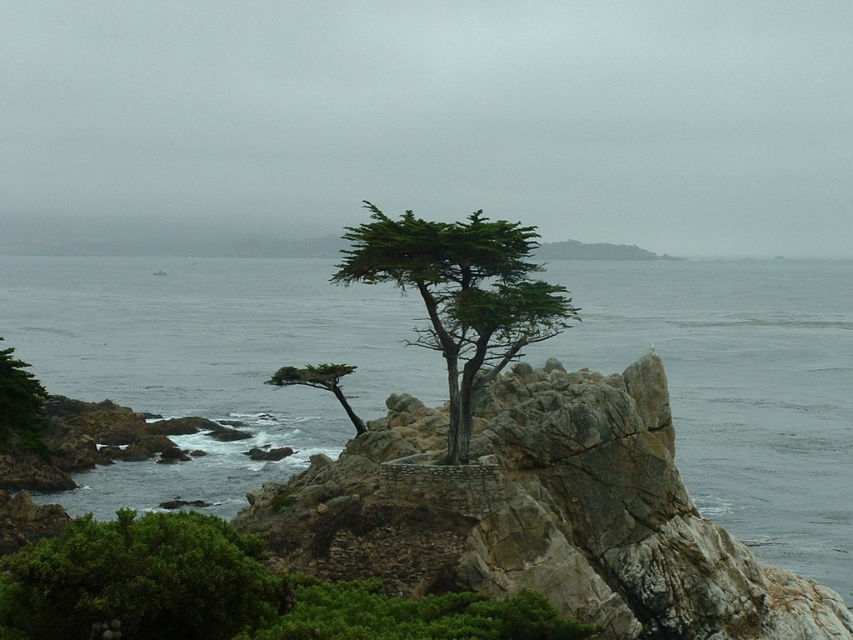
You are a hiker who wants to take a photo of both the green leafy shrub at lower left and the green textured tree at lower left. Since you want to include both in the frame, which object should you focus on to ensure both are visible?

You should focus on the green textured tree at lower left because it is larger than the green leafy shrub at lower left, allowing both to fit in the frame.

You are a bird looking for a nesting spot. The green leafy cypress at center is your potential location. Can you confirm if this tree is positioned at the coordinates approximately 0.463 on the x and 0.540 on the y axis?

The green leafy cypress at center is located at point (460, 296), so yes, the tree is positioned at those coordinates.

You are a bird looking for a nesting spot. You see the green leafy cypress at center and the green textured tree at lower left. Which tree is higher up in the scene?

The green leafy cypress at center is positioned over the green textured tree at lower left, so it is higher up in the scene.